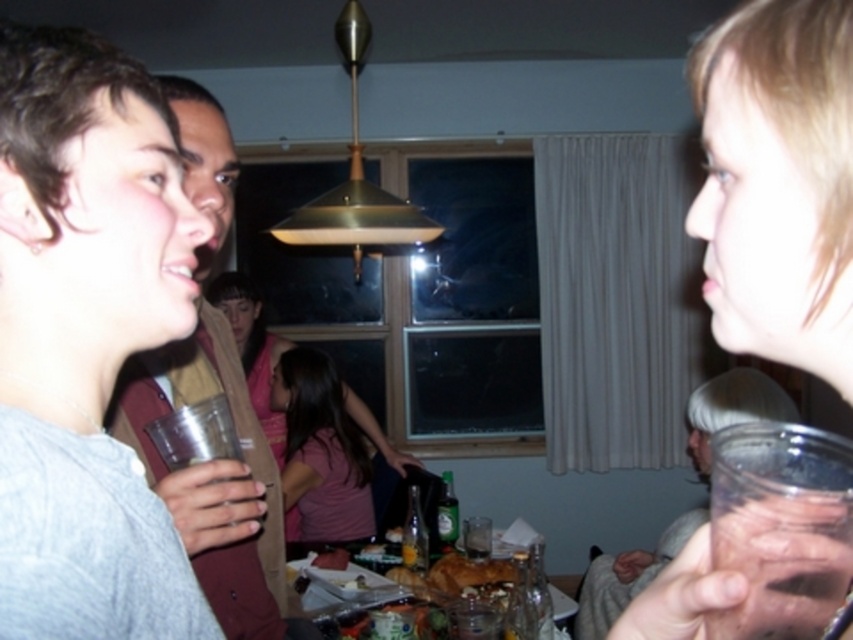
You are a guest at the dinner party and want to grab the translucent plastic cup at upper right without moving the gray knit sweater at left. Is this possible?

The translucent plastic cup at upper right is behind the gray knit sweater at left, so you can reach it without moving the gray knit sweater at left by accessing it from the sides or around the sweater.

You are a guest at the dinner party and need to place your phone on the table. The gray knit sweater at left and the translucent plastic cup at upper right are on the table. Which object has a larger surface area to place your phone?

The gray knit sweater at left has a larger width than the translucent plastic cup at upper right, so it offers a bigger surface area for placing your phone.

You are at a dinner party and need to place your phone on the table. The translucent plastic cup at upper right and the matte brown jacket at left are on the table. Which item can you move to free up more space for your phone?

The matte brown jacket at left occupies more space than the translucent plastic cup at upper right, so moving the matte brown jacket at left would free up more space for your phone.